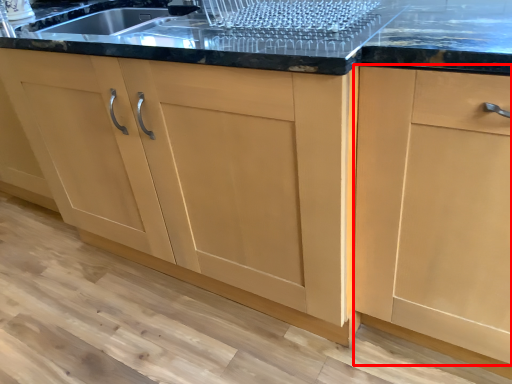
Question: From the image's perspective, where is cabinetry (annotated by the red box) located relative to cabinetry?

Choices:
 (A) above
 (B) below

Answer: (B)